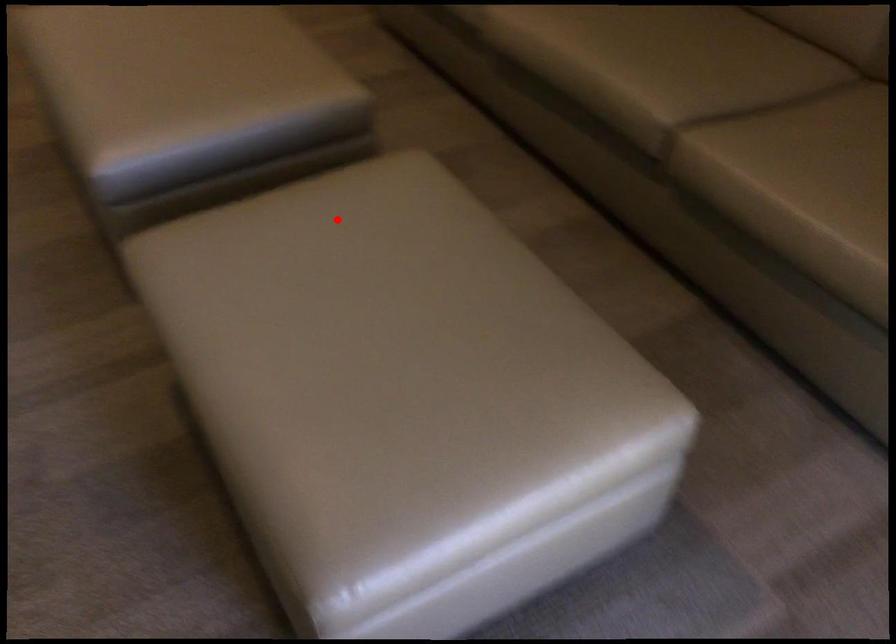
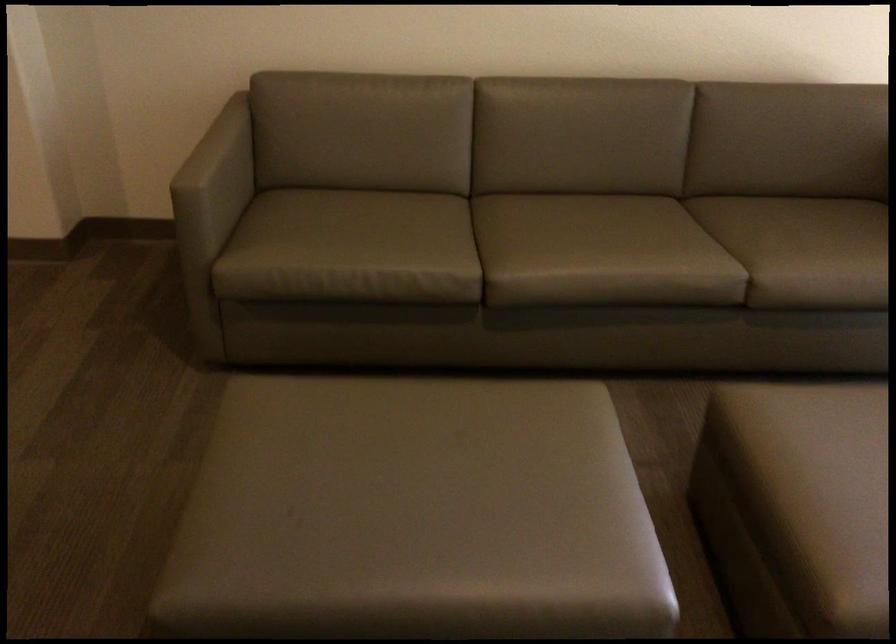
Where in the second image is the point corresponding to the highlighted location from the first image?

(814, 464)